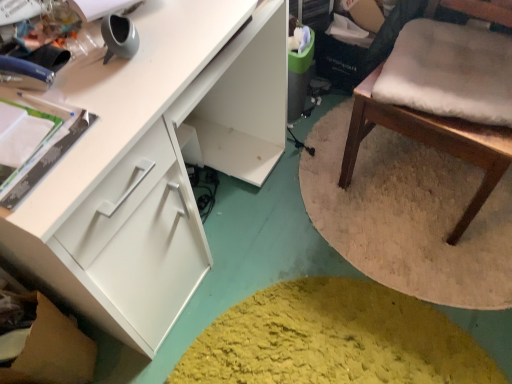
Question: Considering the positions of white matte cabinet at left and wooden chair with white cushion at right in the image, is white matte cabinet at left taller or shorter than wooden chair with white cushion at right?

Choices:
 (A) tall
 (B) short

Answer: (B)

Question: Looking at their shapes, would you say white matte cabinet at left is wider or thinner than wooden chair with white cushion at right?

Choices:
 (A) thin
 (B) wide

Answer: (B)

Question: From the image's perspective, is white matte cabinet at left positioned above or below wooden chair with white cushion at right?

Choices:
 (A) above
 (B) below

Answer: (B)

Question: From their relative heights in the image, would you say wooden chair with white cushion at right is taller or shorter than white matte cabinet at left?

Choices:
 (A) short
 (B) tall

Answer: (B)

Question: Is point (355, 132) positioned closer to the camera than point (139, 107)?

Choices:
 (A) closer
 (B) farther

Answer: (B)

Question: Considering their positions, is wooden chair with white cushion at right located in front of or behind white matte cabinet at left?

Choices:
 (A) front
 (B) behind

Answer: (B)

Question: Is wooden chair with white cushion at right to the left or to the right of white matte cabinet at left in the image?

Choices:
 (A) left
 (B) right

Answer: (B)